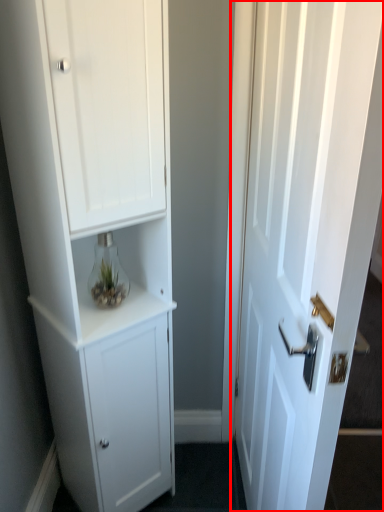
Question: In this image, where is door (annotated by the red box) located relative to cupboard?

Choices:
 (A) right
 (B) left

Answer: (A)